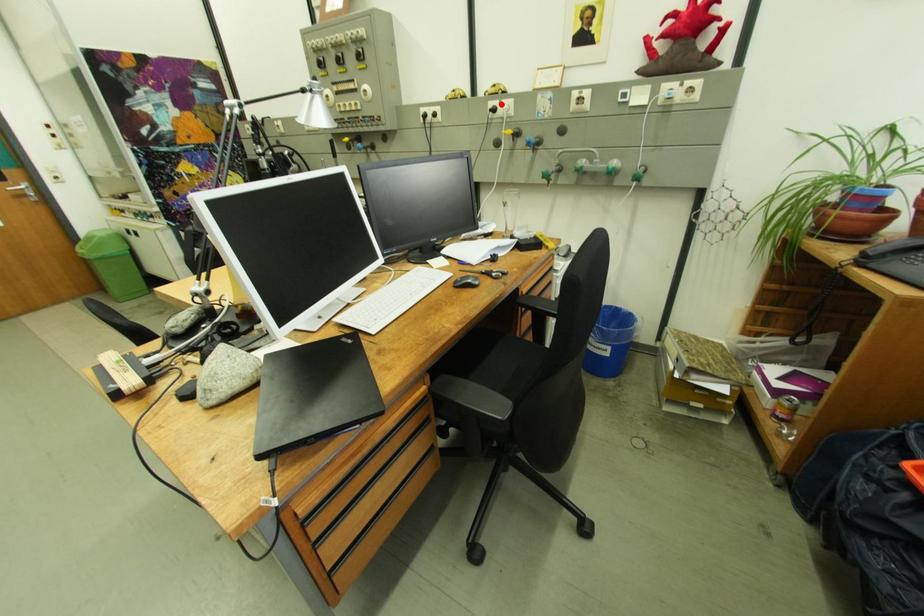
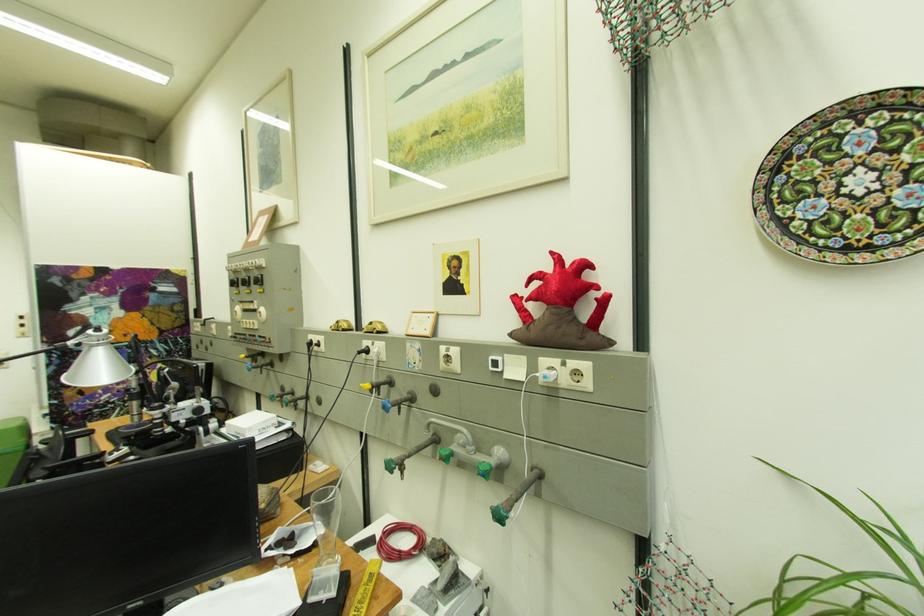
Question: I am providing you with two images of the same scene from different viewpoints. Image1 has a red point marked. In image2, the corresponding 3D location appears at what relative position? Reply with the corresponding letter.

Choices:
 (A) Closer
 (B) Farther

Answer: (B)